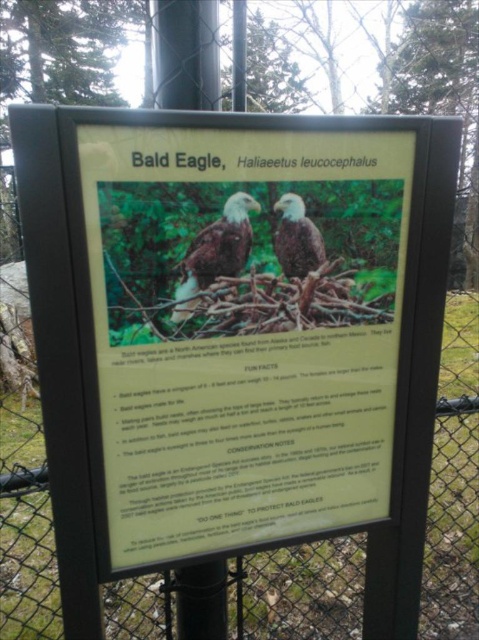
Question: Which point is farther to the camera?

Choices:
 (A) brown feathered eagle at center
 (B) matte brown eagle at center

Answer: (B)

Question: In this image, where is brown feathered eagle at center located relative to matte brown eagle at center?

Choices:
 (A) above
 (B) below

Answer: (B)

Question: Is brown feathered eagle at center thinner than matte brown eagle at center?

Choices:
 (A) no
 (B) yes

Answer: (A)

Question: From the image, what is the correct spatial relationship of brown feathered eagle at center in relation to matte brown eagle at center?

Choices:
 (A) left
 (B) right

Answer: (A)